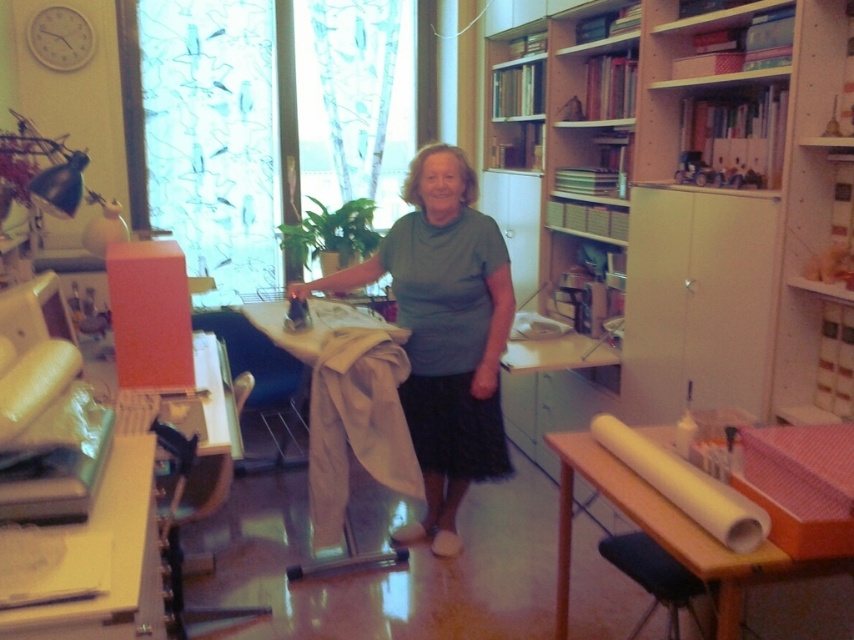
You are standing in the room and want to reach both the point at location (424, 280) and the point at (264, 307). Which point will you reach first?

You will reach the point at location (424, 280) first because it is closer to you than the point at (264, 307).

You are standing in the home office and need to move a box from the wooden table at lower right to the dark blue fabric stool at lower right. Which direction should you move the box to place it on the stool?

You should move the box to the right, since the dark blue fabric stool at lower right is located to the right of the wooden table at lower right.

You are organizing a small event and need to place a 1.2 meter wide banner between the wooden table at lower right and the dark blue fabric stool at lower right. Can the banner fit between them based on their widths?

The wooden table at lower right might be wider than dark blue fabric stool at lower right, so the total width between them is uncertain. Without knowing the exact distance between the two objects, it is impossible to determine if the banner will fit.